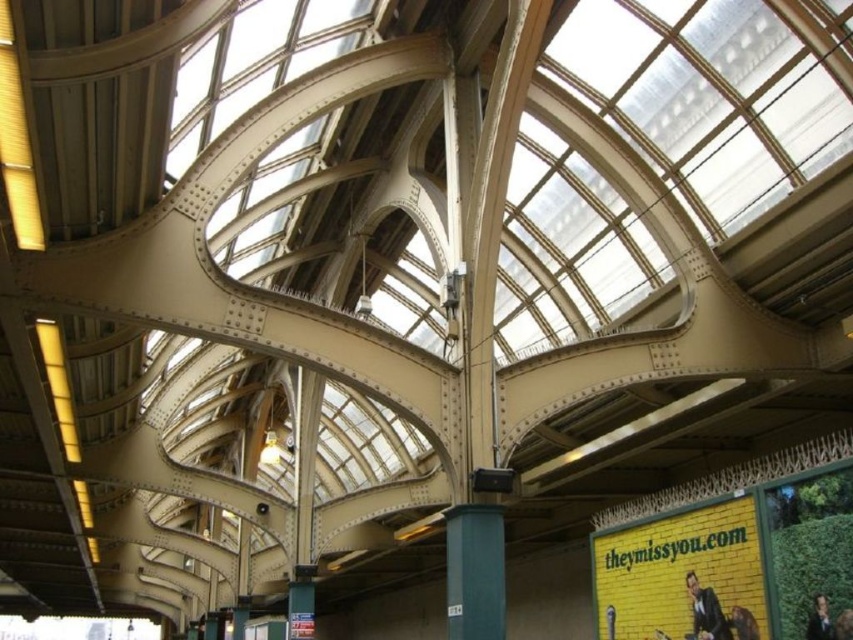
Question: Which point is closer to the camera?

Choices:
 (A) (827, 632)
 (B) (709, 605)

Answer: (A)

Question: Does dark suit at lower right appear on the right side of dark brown hair at lower right?

Choices:
 (A) no
 (B) yes

Answer: (A)

Question: Which object appears closest to the camera in this image?

Choices:
 (A) dark suit at lower right
 (B) dark brown hair at lower right

Answer: (B)

Question: Does dark suit at lower right appear on the left side of dark brown hair at lower right?

Choices:
 (A) no
 (B) yes

Answer: (B)

Question: Is dark suit at lower right smaller than dark brown hair at lower right?

Choices:
 (A) yes
 (B) no

Answer: (B)